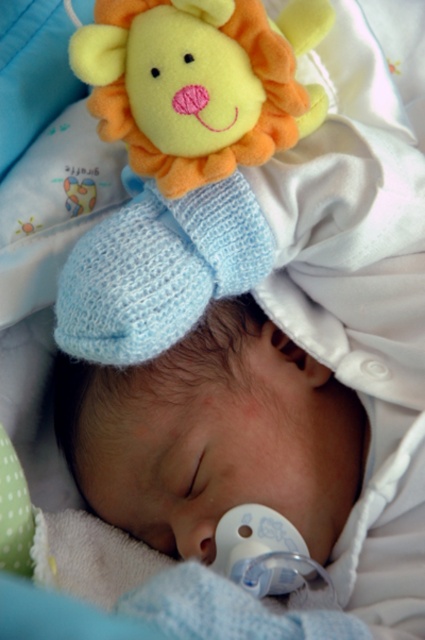
Can you confirm if soft yellow plush lion at upper center is taller than white smooth pacifier at center?

Indeed, soft yellow plush lion at upper center has a greater height compared to white smooth pacifier at center.

You are a GUI agent. You are given a task and a screenshot of the screen. Output one action in this format:
    pyautogui.click(x=<x>, y=<y>)
    Task: Click on the soft yellow plush lion at upper center
    
    Given the screenshot: What is the action you would take?
    pyautogui.click(x=183, y=161)